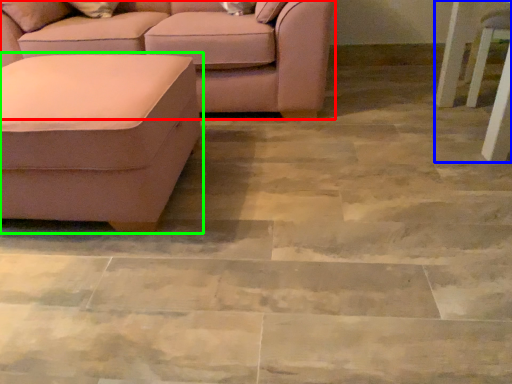
Question: Which object is positioned closest to studio couch (highlighted by a red box)? Select from side table (highlighted by a blue box) and studio couch (highlighted by a green box).

Choices:
 (A) side table
 (B) studio couch

Answer: (B)